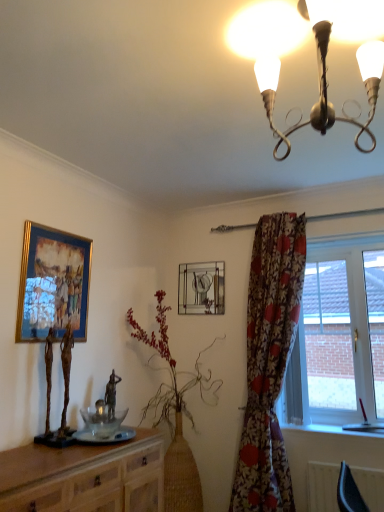
Measure the distance between point (x=192, y=309) and camera.

Point (x=192, y=309) is 11.15 feet away from camera.

You are a GUI agent. You are given a task and a screenshot of the screen. Output one action in this format:
    pyautogui.click(x=<x>, y=<y>)
    Task: Click on the wooden cabinet at lower left
    
    Given the screenshot: What is the action you would take?
    pyautogui.click(x=84, y=476)

What do you see at coordinates (53, 284) in the screenshot?
I see `gold-framed painting at upper left, which appears as the first picture frame when viewed from the front` at bounding box center [53, 284].

Based on the photo, measure the distance between point (156, 345) and camera.

The depth of point (156, 345) is 9.94 feet.

The width and height of the screenshot is (384, 512). What do you see at coordinates (175, 419) in the screenshot?
I see `green leafy plant at center` at bounding box center [175, 419].

This screenshot has width=384, height=512. I want to click on floral fabric curtain at right, so click(269, 362).

From the image's perspective, is green leafy plant at center located above or below gold-framed painting at upper left, which appears as the first picture frame when viewed from the left?

From the image's perspective, green leafy plant at center appears below gold-framed painting at upper left, which appears as the first picture frame when viewed from the left.

In terms of size, does green leafy plant at center appear bigger or smaller than gold-framed painting at upper left, which appears as the first picture frame when viewed from the front?

Considering their sizes, green leafy plant at center takes up more space than gold-framed painting at upper left, which appears as the first picture frame when viewed from the front.

Considering the positions of objects green leafy plant at center and gold-framed painting at upper left, which appears as the first picture frame when viewed from the left, in the image provided, who is in front, green leafy plant at center or gold-framed painting at upper left, which appears as the first picture frame when viewed from the left,?

gold-framed painting at upper left, which appears as the first picture frame when viewed from the left, is closer to the camera.

From a real-world perspective, between green leafy plant at center and gold-framed painting at upper left, which appears as the first picture frame when viewed from the left, who is vertically higher?

gold-framed painting at upper left, which appears as the first picture frame when viewed from the left, from a real-world perspective.

Is metallic chandelier at upper center to the right of floral fabric curtain at right from the viewer's perspective?

No.

Which object is thinner, metallic chandelier at upper center or floral fabric curtain at right?

Thinner between the two is floral fabric curtain at right.

From the image's perspective, is metallic chandelier at upper center beneath floral fabric curtain at right?

Actually, metallic chandelier at upper center appears above floral fabric curtain at right in the image.

Is floral fabric curtain at right a part of metallic chandelier at upper center?

No, floral fabric curtain at right is not surrounded by metallic chandelier at upper center.

Are white plastic window at right and metallic glass clock at center, positioned as the first picture frame in right-to-left order, beside each other?

No.

Which is closer, (303,327) or (224,275)?

The point (303,327) is closer to the camera.

Is white plastic window at right turned away from metallic glass clock at center, positioned as the first picture frame in right-to-left order?

No, metallic glass clock at center, positioned as the first picture frame in right-to-left order, is not at the back of white plastic window at right.

From a real-world perspective, who is located higher, white plastic window at right or metallic glass clock at center, which is the second picture frame from left to right?

metallic glass clock at center, which is the second picture frame from left to right, is physically above.

Who is more distant, floral fabric curtain at right or metallic chandelier at upper center?

Positioned behind is floral fabric curtain at right.

Looking at this image, from a real-world perspective, does floral fabric curtain at right stand above metallic chandelier at upper center?

No, from a real-world perspective, floral fabric curtain at right is not over metallic chandelier at upper center

Is floral fabric curtain at right to the right of metallic chandelier at upper center from the viewer's perspective?

Yes, floral fabric curtain at right is to the right of metallic chandelier at upper center.

Is floral fabric curtain at right taller than metallic chandelier at upper center?

Indeed, floral fabric curtain at right has a greater height compared to metallic chandelier at upper center.

Can you see floral fabric curtain at right touching wooden cabinet at lower left?

No.

Does floral fabric curtain at right have a lesser width compared to wooden cabinet at lower left?

Indeed, floral fabric curtain at right has a lesser width compared to wooden cabinet at lower left.

In the scene shown: Based on their positions, is floral fabric curtain at right located to the left or right of wooden cabinet at lower left?

floral fabric curtain at right is to the right of wooden cabinet at lower left.

In the scene shown: Choose the correct answer: Is floral fabric curtain at right inside wooden cabinet at lower left or outside it?

floral fabric curtain at right exists outside the volume of wooden cabinet at lower left.

From the picture: Is wooden cabinet at lower left placed right next to metallic glass clock at center, which is the 1th picture frame from back to front?

No.

Who is smaller, wooden cabinet at lower left or metallic glass clock at center, positioned as the first picture frame in right-to-left order?

With smaller size is metallic glass clock at center, positioned as the first picture frame in right-to-left order.

Would you say metallic glass clock at center, which is counted as the 2th picture frame, starting from the front, is part of wooden cabinet at lower left's contents?

No, metallic glass clock at center, which is counted as the 2th picture frame, starting from the front, is not inside wooden cabinet at lower left.

From the image's perspective, which is above, wooden cabinet at lower left or metallic glass clock at center, which is the second picture frame from left to right?

metallic glass clock at center, which is the second picture frame from left to right.

Which is more to the left, metallic chandelier at upper center or white plastic window at right?

metallic chandelier at upper center is more to the left.

Consider the image. Could you tell me if metallic chandelier at upper center is facing white plastic window at right?

No, metallic chandelier at upper center does not turn towards white plastic window at right.

Which is more distant, (243,30) or (319,277)?

Point (319,277)

Is metallic chandelier at upper center surrounding white plastic window at right?

No, white plastic window at right is located outside of metallic chandelier at upper center.

From the image's perspective, starting from the green leafy plant at center, which picture frame is the 2nd one above? Please provide its 2D coordinates.

[(53, 284)]

Image resolution: width=384 pixels, height=512 pixels. Find the location of `lamp to the left of floral fabric curtain at right`. lamp to the left of floral fabric curtain at right is located at coordinates (317, 54).

Based on their spatial positions, is metallic chandelier at upper center or wooden cabinet at lower left further from gold-framed painting at upper left, the second picture frame viewed from the back?

metallic chandelier at upper center.

Looking at the image, which one is located closer to floral fabric curtain at right, metallic glass clock at center, which is the second picture frame from left to right, or white plastic window at right?

Based on the image, white plastic window at right appears to be nearer to floral fabric curtain at right.

From the image, which object appears to be farther from white plastic window at right, metallic chandelier at upper center or floral fabric curtain at right?

Among the two, metallic chandelier at upper center is located further to white plastic window at right.

Which object lies nearer to the anchor point green leafy plant at center, white plastic window at right or floral fabric curtain at right?

Among the two, floral fabric curtain at right is located nearer to green leafy plant at center.

Which object lies further to the anchor point green leafy plant at center, wooden cabinet at lower left or floral fabric curtain at right?

wooden cabinet at lower left is further to green leafy plant at center.

In the scene shown: Looking at the image, which one is located closer to white plastic window at right, green leafy plant at center or metallic glass clock at center, which is the 1th picture frame from back to front?

metallic glass clock at center, which is the 1th picture frame from back to front, is positioned closer to the anchor white plastic window at right.

From the image, which object appears to be nearer to wooden cabinet at lower left, white plastic window at right or floral fabric curtain at right?

Based on the image, floral fabric curtain at right appears to be nearer to wooden cabinet at lower left.

Considering their positions, is green leafy plant at center positioned closer to metallic chandelier at upper center than white plastic window at right?

white plastic window at right lies closer to metallic chandelier at upper center than the other object.

I want to click on picture frame between metallic chandelier at upper center and metallic glass clock at center, which is counted as the 2th picture frame, starting from the front, along the z-axis, so click(x=53, y=284).

Locate an element on the screen. This screenshot has width=384, height=512. curtain located between wooden cabinet at lower left and metallic glass clock at center, positioned as the first picture frame in right-to-left order, in the depth direction is located at coordinates (269, 362).

Where is `picture frame between green leafy plant at center and white plastic window at right in the horizontal direction`? picture frame between green leafy plant at center and white plastic window at right in the horizontal direction is located at coordinates (201, 288).

Find the location of a particular element. picture frame located between wooden cabinet at lower left and metallic glass clock at center, positioned as the first picture frame in right-to-left order, in the depth direction is located at coordinates (53, 284).